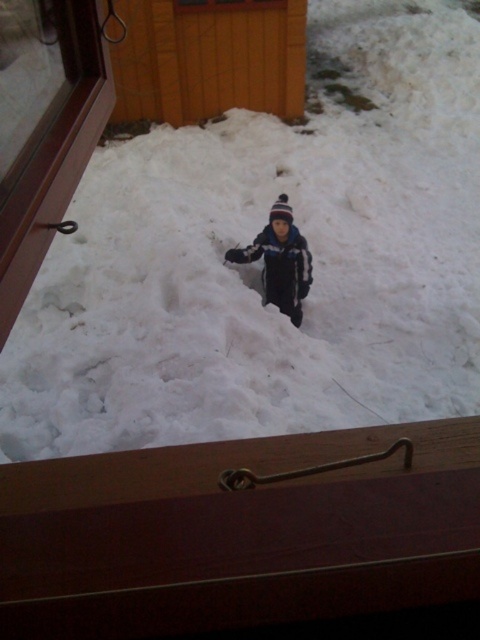
Who is more distant from viewer, (x=31, y=330) or (x=276, y=264)?

The point (x=276, y=264) is more distant.

Is white fluffy snow at center in front of dark blue fleece jacket at center?

Yes, white fluffy snow at center is in front of dark blue fleece jacket at center.

Locate an element on the screen. Image resolution: width=480 pixels, height=640 pixels. white fluffy snow at center is located at coordinates (261, 260).

This screenshot has width=480, height=640. Find the location of `white fluffy snow at center`. white fluffy snow at center is located at coordinates (261, 260).